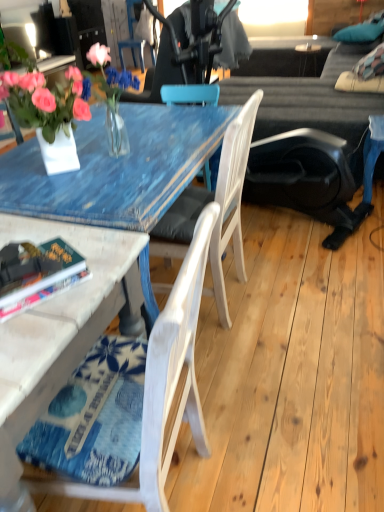
This screenshot has width=384, height=512. In order to click on vacant area located to the right-hand side of hardcover book at lower left in this screenshot , I will do `click(102, 268)`.